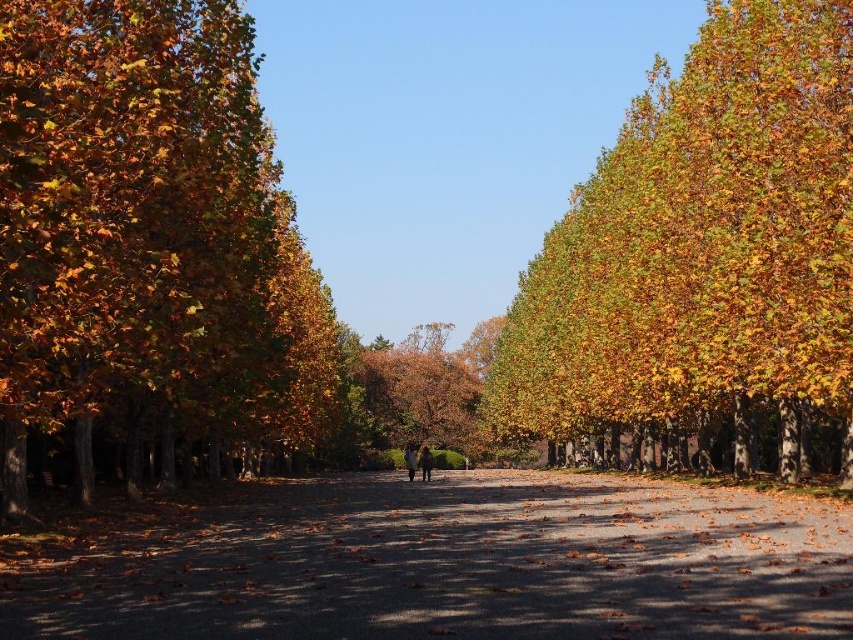
Does brown gravel path at center have a lesser width compared to golden leafy tree at center?

No, brown gravel path at center is not thinner than golden leafy tree at center.

Measure the distance between brown gravel path at center and golden leafy tree at center.

They are 74.46 meters apart.

The width and height of the screenshot is (853, 640). In order to click on brown gravel path at center in this screenshot , I will do `click(453, 564)`.

Is golden leafy tree at left bigger than brown gravel path at center?

Correct, golden leafy tree at left is larger in size than brown gravel path at center.

Is golden leafy tree at left taller than brown gravel path at center?

Correct, golden leafy tree at left is much taller as brown gravel path at center.

Does point (21, 339) lie behind point (515, 584)?

Yes, it is behind point (515, 584).

Where is `golden leafy tree at left`? The height and width of the screenshot is (640, 853). golden leafy tree at left is located at coordinates (146, 230).

Who is more forward, (113,38) or (602,168)?

Point (113,38)

Looking at this image, between golden leafy tree at left and golden yellow leaves at upper right, which one appears on the left side from the viewer's perspective?

Positioned to the left is golden leafy tree at left.

Who is more forward, (271, 212) or (761, 308)?

Point (761, 308)

You are a GUI agent. You are given a task and a screenshot of the screen. Output one action in this format:
    pyautogui.click(x=<x>, y=<y>)
    Task: Click on the golden leafy tree at left
    
    Given the screenshot: What is the action you would take?
    pyautogui.click(x=146, y=230)